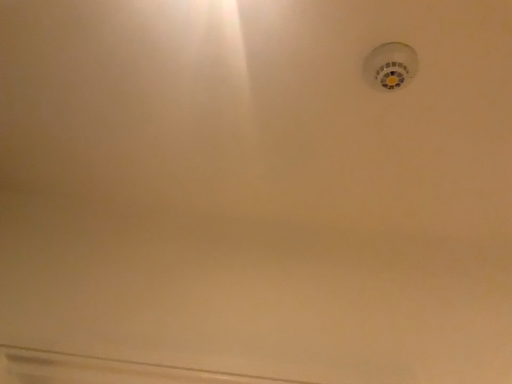
What do you see at coordinates (390, 66) in the screenshot? This screenshot has height=384, width=512. I see `white plastic smoke detector at upper right` at bounding box center [390, 66].

At what (x,y) coordinates should I click in order to perform the action: click on white plastic smoke detector at upper right. Please return your answer as a coordinate pair (x, y). This screenshot has height=384, width=512. Looking at the image, I should click on (390, 66).

What are the coordinates of `white plastic smoke detector at upper right` in the screenshot? It's located at (390, 66).